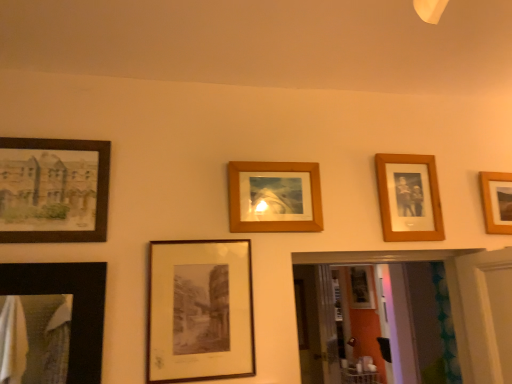
Question: Should I look upward or downward to see wooden photo frame at upper right, the 2th picture frame from the right?

Choices:
 (A) up
 (B) down

Answer: (B)

Question: Is wooden photo frame at upper right, the fourth picture frame positioned from the left, facing towards matte black frame at center, acting as the 2th picture frame starting from the left?

Choices:
 (A) yes
 (B) no

Answer: (B)

Question: Can you confirm if wooden photo frame at upper right, the 2th picture frame from the right, is wider than matte black frame at center, acting as the 2th picture frame starting from the left?

Choices:
 (A) no
 (B) yes

Answer: (B)

Question: Considering the relative positions of wooden photo frame at upper right, the fourth picture frame positioned from the left, and matte black frame at center, marked as the 4th picture frame in a right-to-left arrangement, in the image provided, is wooden photo frame at upper right, the fourth picture frame positioned from the left, to the left of matte black frame at center, marked as the 4th picture frame in a right-to-left arrangement, from the viewer's perspective?

Choices:
 (A) no
 (B) yes

Answer: (A)

Question: Can you confirm if wooden photo frame at upper right, the fourth picture frame positioned from the left, is thinner than matte black frame at center, acting as the 2th picture frame starting from the left?

Choices:
 (A) yes
 (B) no

Answer: (B)

Question: Can you confirm if wooden photo frame at upper right, the fourth picture frame positioned from the left, is smaller than matte black frame at center, marked as the 4th picture frame in a right-to-left arrangement?

Choices:
 (A) no
 (B) yes

Answer: (B)

Question: Is wooden photo frame at upper right, the fourth picture frame positioned from the left, looking in the opposite direction of matte black frame at center, acting as the 2th picture frame starting from the left?

Choices:
 (A) yes
 (B) no

Answer: (B)

Question: Is matte black frame at center, marked as the 4th picture frame in a right-to-left arrangement, at the left side of wooden frame at upper right, the 5th picture frame positioned from the left?

Choices:
 (A) yes
 (B) no

Answer: (A)

Question: From the image's perspective, is matte black frame at center, marked as the 4th picture frame in a right-to-left arrangement, located beneath wooden frame at upper right, the 5th picture frame positioned from the left?

Choices:
 (A) no
 (B) yes

Answer: (B)

Question: From a real-world perspective, is matte black frame at center, marked as the 4th picture frame in a right-to-left arrangement, positioned over wooden frame at upper right, acting as the first picture frame starting from the right, based on gravity?

Choices:
 (A) no
 (B) yes

Answer: (A)

Question: From a real-world perspective, is matte black frame at center, acting as the 2th picture frame starting from the left, physically below wooden frame at upper right, acting as the first picture frame starting from the right?

Choices:
 (A) no
 (B) yes

Answer: (B)

Question: Can we say matte black frame at center, acting as the 2th picture frame starting from the left, lies outside wooden frame at upper right, acting as the first picture frame starting from the right?

Choices:
 (A) no
 (B) yes

Answer: (B)

Question: Considering the relative sizes of matte black frame at center, acting as the 2th picture frame starting from the left, and wooden frame at upper right, acting as the first picture frame starting from the right, in the image provided, is matte black frame at center, acting as the 2th picture frame starting from the left, bigger than wooden frame at upper right, acting as the first picture frame starting from the right,?

Choices:
 (A) no
 (B) yes

Answer: (B)

Question: Can wooden frame at center, which appears as the third picture frame when viewed from the right, be found inside wooden photo frame at upper right, the fourth picture frame positioned from the left?

Choices:
 (A) no
 (B) yes

Answer: (A)